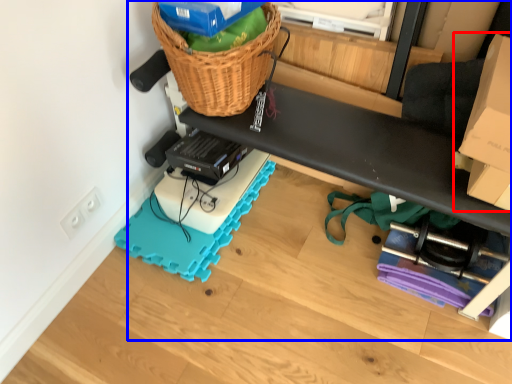
Question: Which object appears closest to the camera in this image, cardboard box (highlighted by a red box) or furniture (highlighted by a blue box)?

Choices:
 (A) cardboard box
 (B) furniture

Answer: (B)